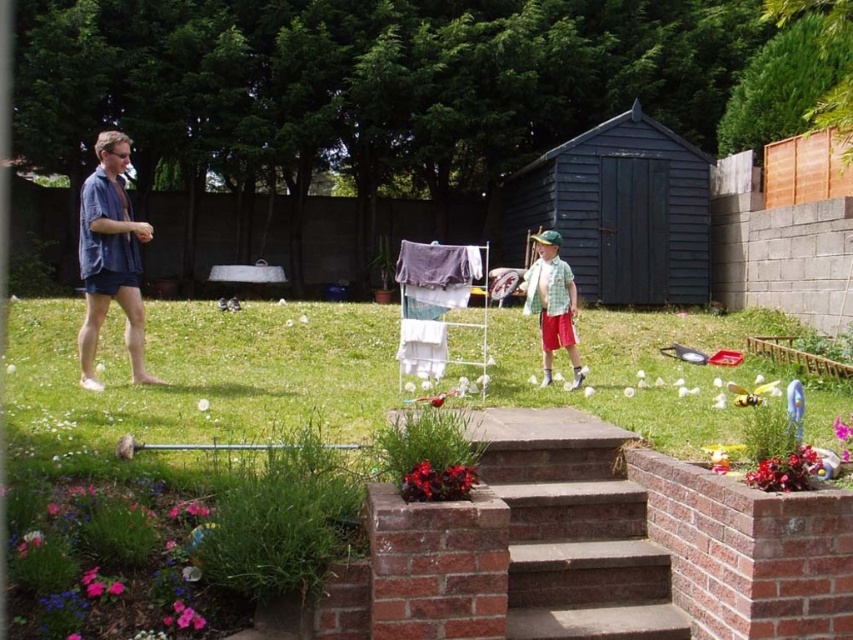
You are trying to place a new decorative statue that is 1.5 meters wide in the backyard. The statue must be placed either in the brick planter at lower center or on the brown concrete stairs at center. Based on the scene, which location can accommodate the statue?

The brick planter at lower center has a larger width than the brown concrete stairs at center, so the statue can be placed in the brick planter at lower center.

You are standing at the point labeled point [627,566] and want to walk to the point labeled point [549,296]. According to the scene description, which direction should you face to move towards your destination?

Since point [627,566] is in front of point [549,296], you should face backwards to move towards your destination.